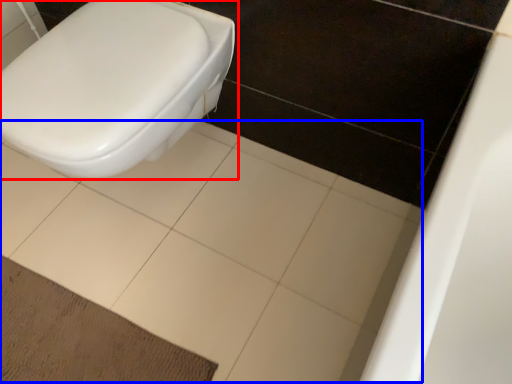
Question: Which object appears farthest to the camera in this image, toilet (highlighted by a red box) or ceramic tile (highlighted by a blue box)?

Choices:
 (A) toilet
 (B) ceramic tile

Answer: (B)